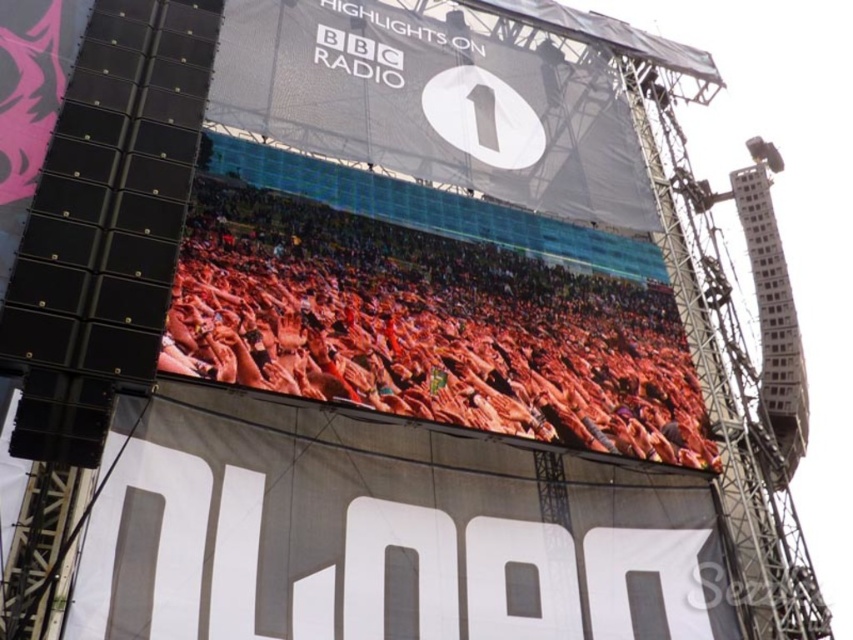
You are standing in front of the billboard and want to touch the point at coordinates point (283, 339). Can you reach it without any tools?

The point (283, 339) is 46.41 meters away from the viewer, so you cannot reach it without any tools.